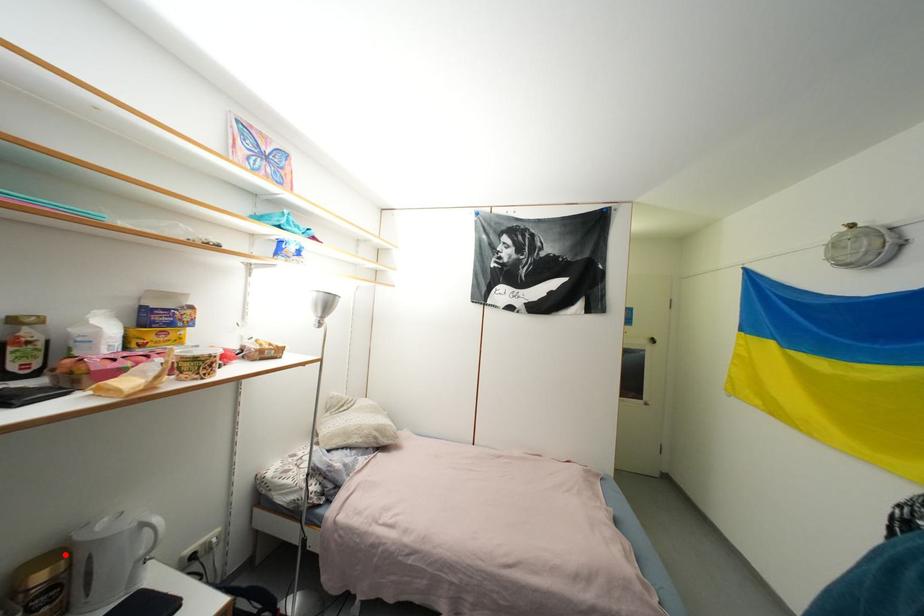
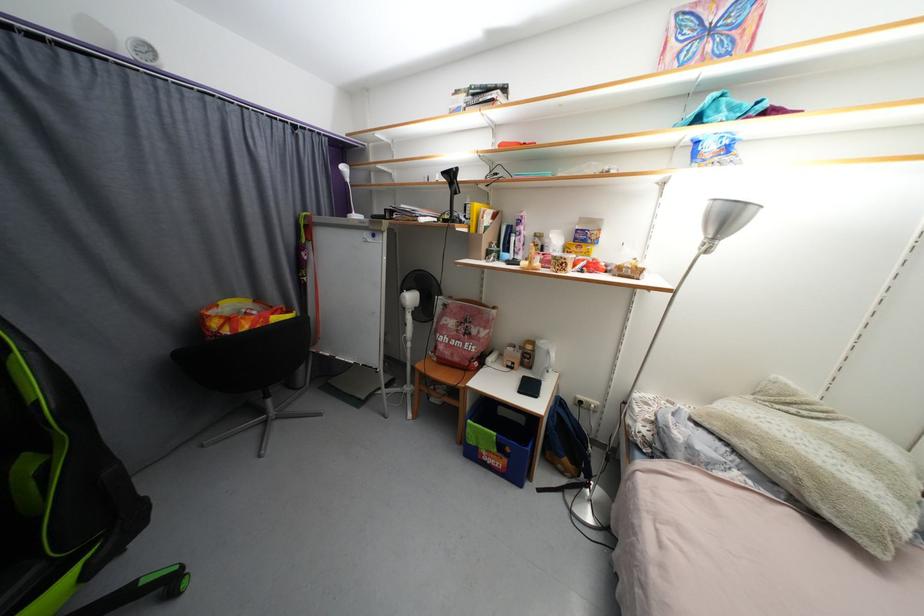
Question: I am providing you with two images of the same scene from different viewpoints. In image1, a red point is highlighted. Considering the same 3D point in image2, which of the following is correct?

Choices:
 (A) It is closer
 (B) It is farther

Answer: (A)